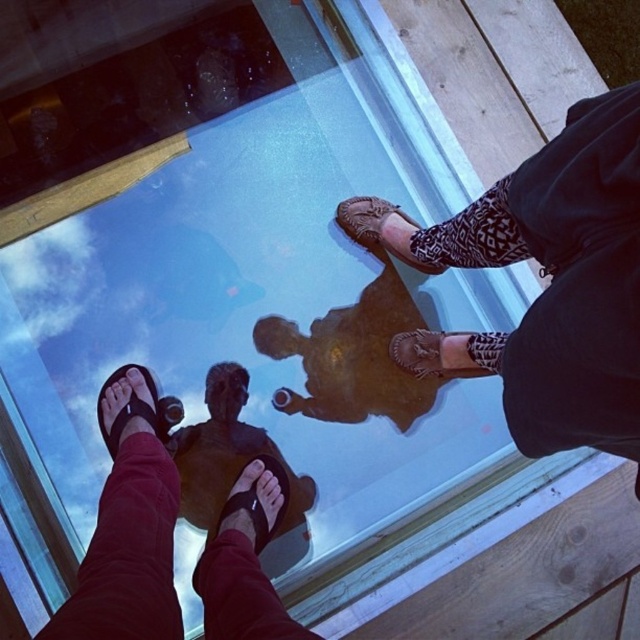
Question: Is black leather sandal at lower center to the right of black leather sandal at lower left from the viewer's perspective?

Choices:
 (A) no
 (B) yes

Answer: (B)

Question: Estimate the real-world distances between objects in this image. Which object is closer to the black matte sandals at lower left?

Choices:
 (A) brown woven sandal at center
 (B) black leather sandal at lower center
 (C) black leather sandal at lower left

Answer: (B)

Question: Which object is farther from the camera taking this photo?

Choices:
 (A) black leather sandal at lower center
 (B) black leather sandal at lower left
 (C) brown woven sandals at center
 (D) black matte sandals at lower left

Answer: (B)

Question: Is brown woven sandal at center positioned at the back of leather textured shoe at center?

Choices:
 (A) yes
 (B) no

Answer: (B)

Question: Which is farther from the brown woven sandals at center?

Choices:
 (A) brown woven sandal at center
 (B) black leather sandal at lower center

Answer: (B)

Question: Considering the relative positions of brown woven sandals at center and brown woven sandal at center in the image provided, where is brown woven sandals at center located with respect to brown woven sandal at center?

Choices:
 (A) right
 (B) left

Answer: (A)